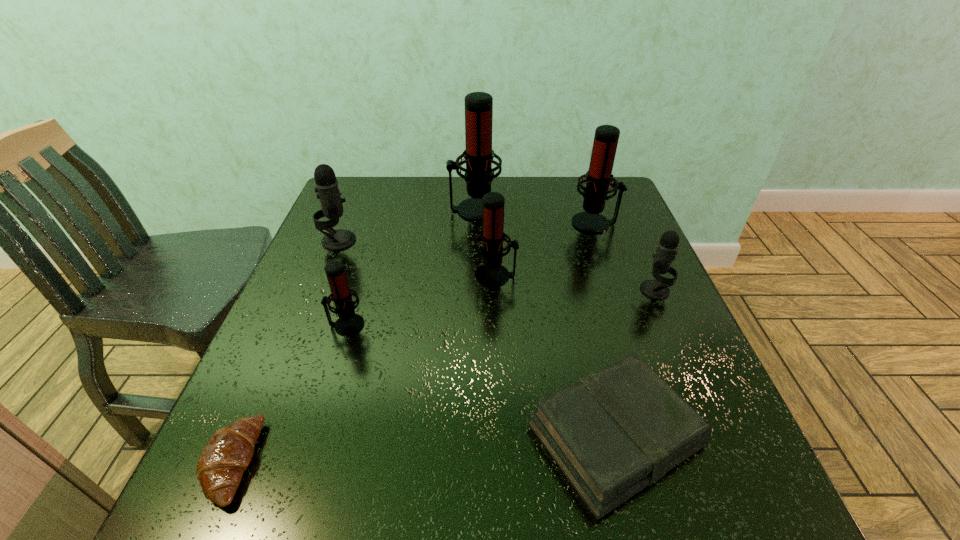
Where is `vacant area that lies between the biggest red microphone and the shortest object`? The height and width of the screenshot is (540, 960). vacant area that lies between the biggest red microphone and the shortest object is located at coordinates (353, 336).

Find the location of a particular element. This screenshot has height=540, width=960. free space between the second tallest object and the right black microphone is located at coordinates (625, 256).

Select which object appears as the fourth closest to the third smallest red microphone. Please provide its 2D coordinates. Your answer should be formatted as a tuple, i.e. [(x, y)], where the tuple contains the x and y coordinates of a point satisfying the conditions above.

[(612, 433)]

Identify which object is the third nearest to the farther black microphone. Please provide its 2D coordinates. Your answer should be formatted as a tuple, i.e. [(x, y)], where the tuple contains the x and y coordinates of a point satisfying the conditions above.

[(491, 273)]

Where is `microphone that is the closest one to the third smallest red microphone`? This screenshot has height=540, width=960. microphone that is the closest one to the third smallest red microphone is located at coordinates [x=666, y=251].

The width and height of the screenshot is (960, 540). What are the coordinates of `microphone that can be found as the third closest to the right black microphone` in the screenshot? It's located at (478, 155).

Identify which red microphone is located as the third nearest to the second shortest object. Please provide its 2D coordinates. Your answer should be formatted as a tuple, i.e. [(x, y)], where the tuple contains the x and y coordinates of a point satisfying the conditions above.

[(598, 179)]

Point out which red microphone is positioned as the second nearest to the third biggest red microphone. Please provide its 2D coordinates. Your answer should be formatted as a tuple, i.e. [(x, y)], where the tuple contains the x and y coordinates of a point satisfying the conditions above.

[(598, 179)]